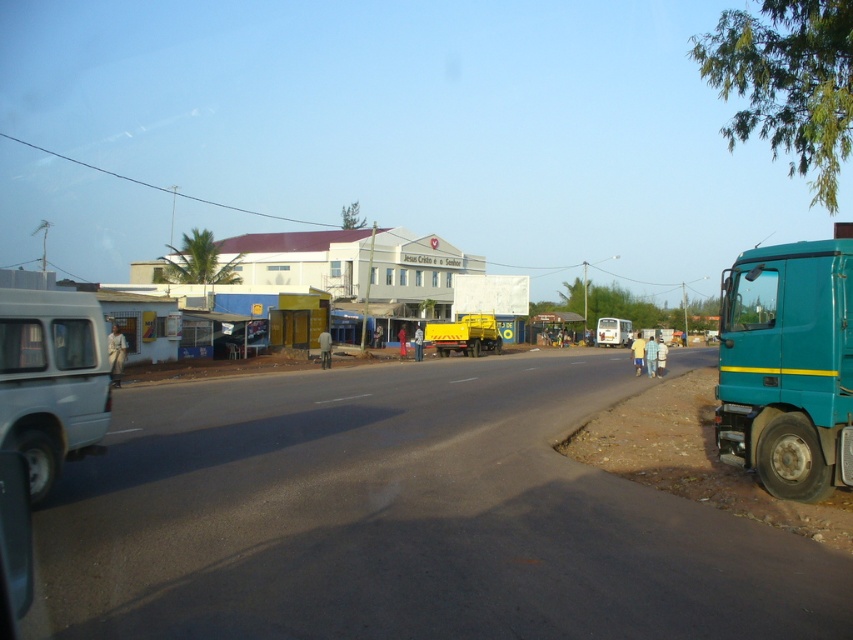
Consider the image. You are a pedestrian standing at the edge of the road and want to cross to the buildings on the left. There are two vehicles blocking your path at the center of the road. Which vehicle is closer to you, the yellow matte truck at center or the white matte van at center?

The white matte van at center is closer to you because the yellow matte truck at center is located above it, meaning the van is positioned lower and thus nearer in the road.

You are standing at the point closer to the viewer between the two points, point (718,445) and point (1,291). Which point are you standing at?

You are standing at point (718,445) because it is further to the viewer than point (1,291).

You are a delivery person who needs to drive a 2.5 meters tall truck through the narrow alley behind the teal matte truck at right and the light blue matte van at left. The alley has a height restriction of 3 meters. Can you safely pass through with your truck?

The teal matte truck at right is taller than the light blue matte van at left. Since the alley has a height restriction of 3 meters and your truck is 2.5 meters tall, you can safely pass through as your truck is shorter than the limit.